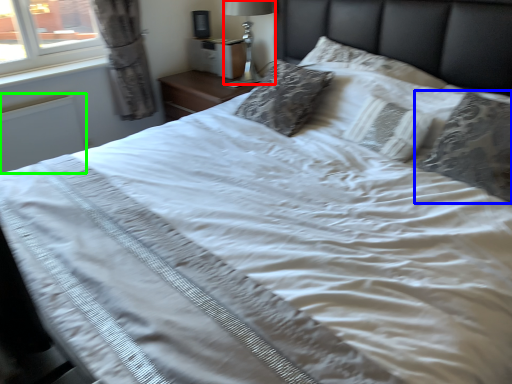
Question: Which object is positioned closest to bedside lamp (highlighted by a red box)? Select from pillow (highlighted by a blue box) and radiator (highlighted by a green box).

Choices:
 (A) pillow
 (B) radiator

Answer: (B)